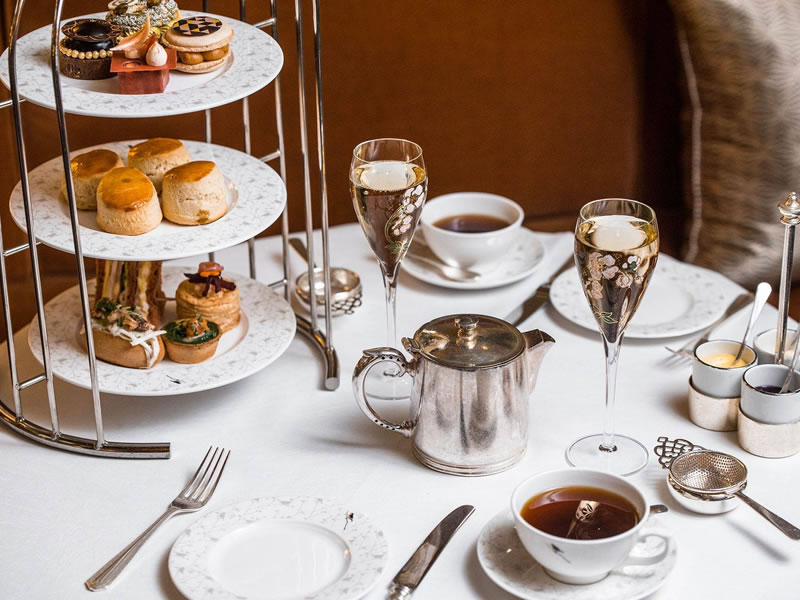
At what (x,y) coordinates should I click in order to perform the action: click on cup. Please return your answer as a coordinate pair (x, y). The image size is (800, 600). Looking at the image, I should click on (590, 531).